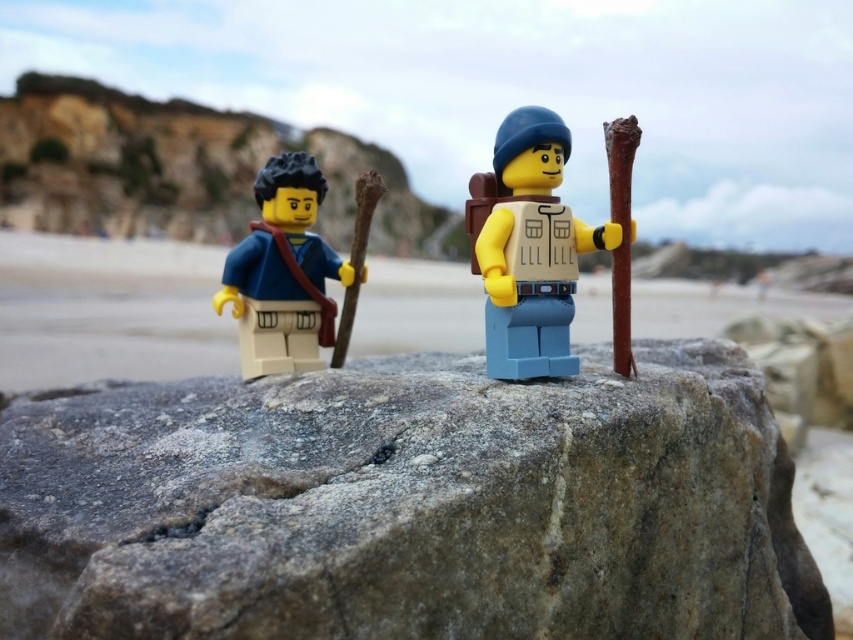
Looking at this image, you are standing at the center of the image. Which direction should you move to reach the smooth sand at lower left?

You should move towards the lower left direction to reach the smooth sand at lower left because it is located at point (108, 310).

You are a drone operator trying to capture a photo of both LEGO figures from above. The camera can only focus on objects within a 0.1 unit radius around the center point. You want to position the camera so that both points are within the focus area. Is it possible to choose a center point such that both point [375,308] and point [543,337] are within the 0.1 radius? Explain your reasoning.

The distance between the two points is sqrt